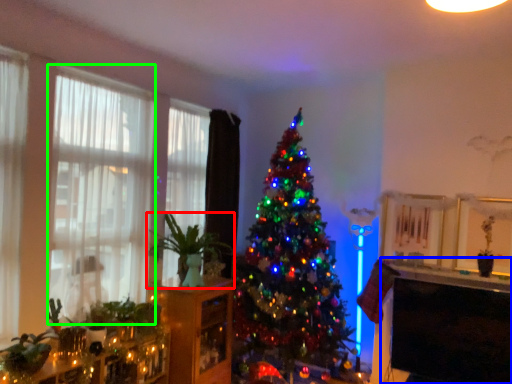
Question: Estimate the real-world distances between objects in this image. Which object is farther from houseplant (highlighted by a red box), table (highlighted by a blue box) or window (highlighted by a green box)?

Choices:
 (A) table
 (B) window

Answer: (A)